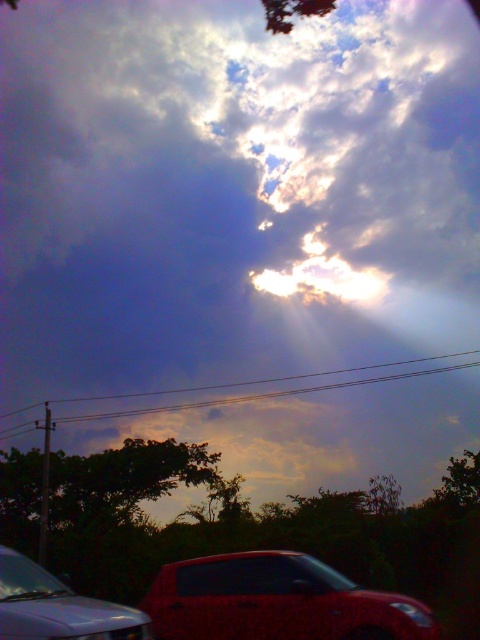
Question: Is glossy metallic car at lower center to the left of metallic red car at lower left from the viewer's perspective?

Choices:
 (A) yes
 (B) no

Answer: (B)

Question: Does glossy metallic car at lower center come in front of metallic red car at lower left?

Choices:
 (A) no
 (B) yes

Answer: (A)

Question: Which of the following is the closest to the observer?

Choices:
 (A) (384, 604)
 (B) (66, 595)

Answer: (B)

Question: From the image, what is the correct spatial relationship of glossy metallic car at lower center in relation to metallic red car at lower left?

Choices:
 (A) below
 (B) above

Answer: (A)